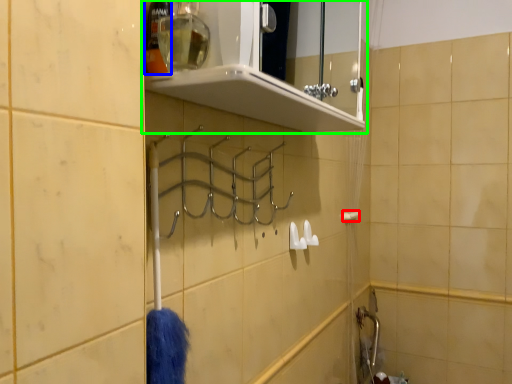
Question: Estimate the real-world distances between objects in this image. Which object is farther from towel bar (highlighted by a red box), toiletry (highlighted by a blue box) or shelf (highlighted by a green box)?

Choices:
 (A) toiletry
 (B) shelf

Answer: (A)